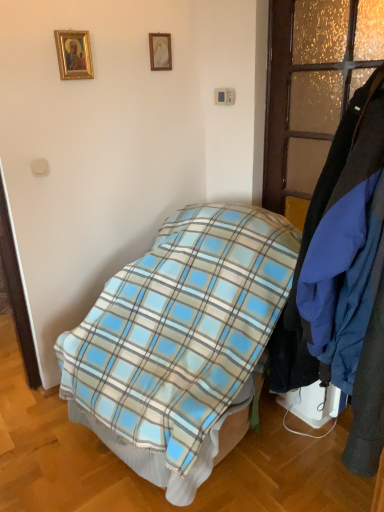
Question: In the image, is translucent frosted glass door at right positioned in front of or behind matte gold picture frame at upper center, arranged as the 2th picture frame when viewed from the front?

Choices:
 (A) front
 (B) behind

Answer: (A)

Question: From the image's perspective, is translucent frosted glass door at right positioned above or below matte gold picture frame at upper center, arranged as the 2th picture frame when viewed from the front?

Choices:
 (A) above
 (B) below

Answer: (B)

Question: Which object is positioned closest to the blue fabric coat at right?

Choices:
 (A) gold-framed picture at upper left, which is the 2th picture frame in right-to-left order
 (B) blue plaid blanket at center
 (C) matte gold picture frame at upper center, the first picture frame in the back-to-front sequence
 (D) translucent frosted glass door at right

Answer: (B)

Question: Estimate the real-world distances between objects in this image. Which object is closer to the gold-framed picture at upper left, arranged as the 1th picture frame when viewed from the front?

Choices:
 (A) translucent frosted glass door at right
 (B) blue plaid blanket at center
 (C) matte gold picture frame at upper center, which is counted as the first picture frame, starting from the right
 (D) blue fabric coat at right

Answer: (C)